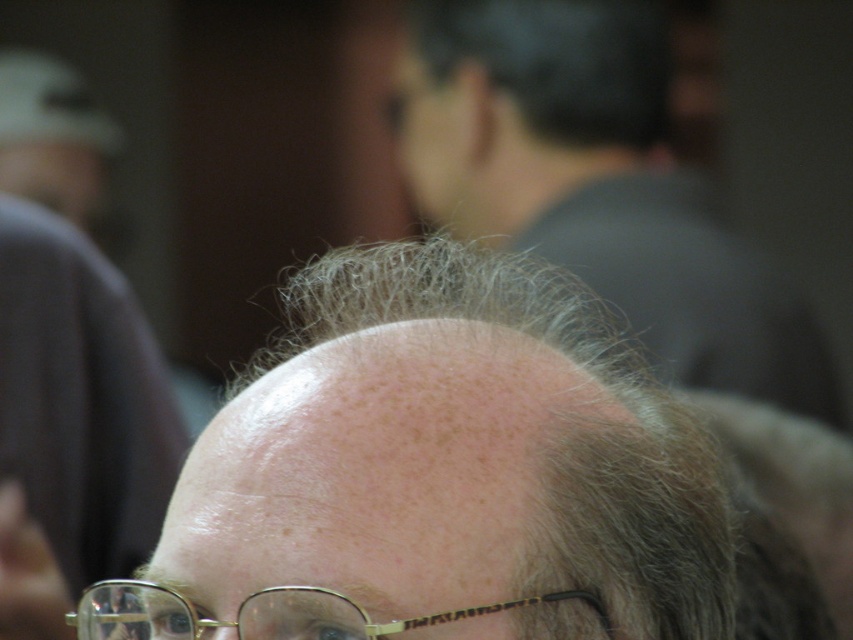
Question: Which object is the farthest from the slightly gray hair at center?

Choices:
 (A) gold-framed glasses at center
 (B) gray matte hair at center

Answer: (A)

Question: Which point is farther from the camera taking this photo?

Choices:
 (A) (469, 288)
 (B) (155, 630)
 (C) (659, 237)
 (D) (27, 230)

Answer: (C)

Question: Is slightly gray hair at center positioned behind gold-framed glasses at center?

Choices:
 (A) no
 (B) yes

Answer: (B)

Question: Which is farther from the gold-framed glasses at center?

Choices:
 (A) slightly gray hair at center
 (B) gray matte hair at center

Answer: (A)

Question: Does gray matte hair at center have a larger size compared to slightly gray hair at center?

Choices:
 (A) no
 (B) yes

Answer: (A)

Question: Is smooth skin head at center thinner than gray matte hair at center?

Choices:
 (A) no
 (B) yes

Answer: (A)